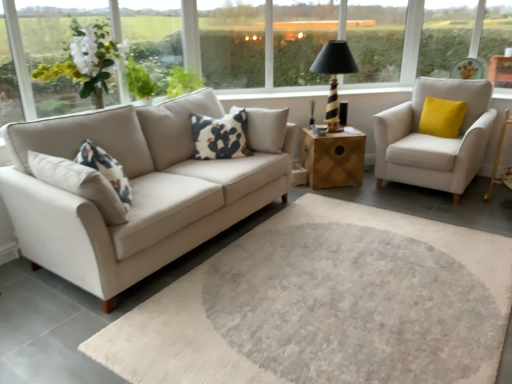
Question: Looking at the image, does white fabric armchair at right seem bigger or smaller compared to black striped wood table lamp at upper center?

Choices:
 (A) big
 (B) small

Answer: (A)

Question: Considering the positions of white fabric armchair at right and black striped wood table lamp at upper center in the image, is white fabric armchair at right taller or shorter than black striped wood table lamp at upper center?

Choices:
 (A) short
 (B) tall

Answer: (B)

Question: Which is farther from the black and white printed pillow at center, which appears as the 1th pillow when viewed from the front?

Choices:
 (A) wooden side table at center
 (B) white matte flower at upper left
 (C) black striped wood table lamp at upper center
 (D) yellow velvet pillow at right, placed as the 1th pillow when sorted from right to left
 (E) white fabric armchair at right

Answer: (D)

Question: Based on their relative distances, which object is farther from the black and white printed pillow at center, which appears as the 1th pillow when viewed from the front?

Choices:
 (A) white matte flower at upper left
 (B) wooden side table at center
 (C) black striped wood table lamp at upper center
 (D) yellow velvet pillow at right, the second pillow viewed from the left
 (E) white fabric armchair at right

Answer: (D)